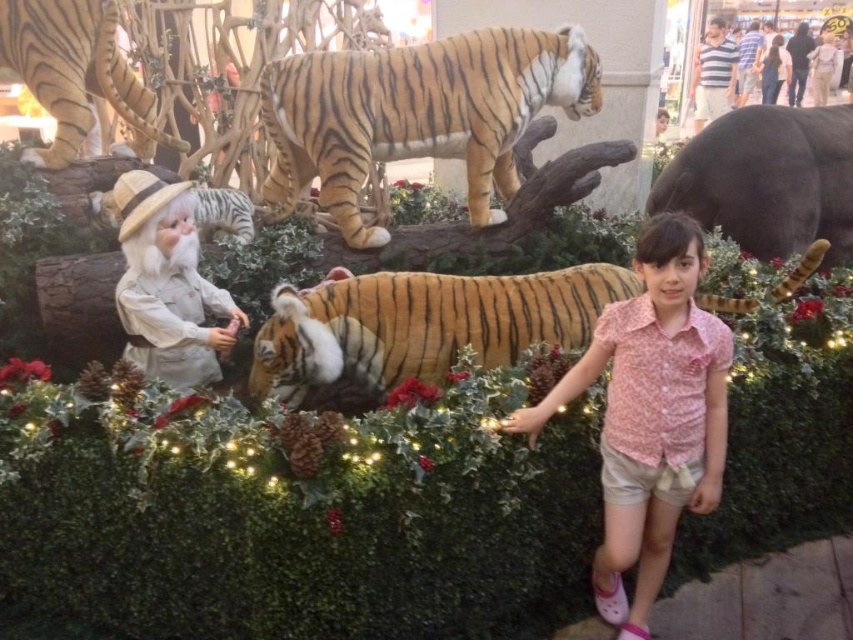
Question: Can you confirm if orange-brown striped tiger at upper center is positioned above white matte santa claus at left?

Choices:
 (A) yes
 (B) no

Answer: (A)

Question: Which of these objects is positioned farthest from the smooth gray elephant at upper right?

Choices:
 (A) white matte santa claus at left
 (B) orange-brown fur tiger at center
 (C) orange striped fur at upper left
 (D) orange-brown striped tiger at upper center

Answer: (C)

Question: Can you confirm if orange-brown striped tiger at upper center is bigger than pink floral shirt at center?

Choices:
 (A) no
 (B) yes

Answer: (B)

Question: Which point is closer to the camera taking this photo?

Choices:
 (A) (756, 236)
 (B) (282, 384)
 (C) (212, 369)
 (D) (30, 58)

Answer: (B)

Question: Which point appears closest to the camera in this image?

Choices:
 (A) (167, 218)
 (B) (492, 84)
 (C) (656, 195)
 (D) (115, 49)

Answer: (A)

Question: Can you confirm if white matte santa claus at left is positioned to the left of orange striped fur at upper left?

Choices:
 (A) no
 (B) yes

Answer: (A)